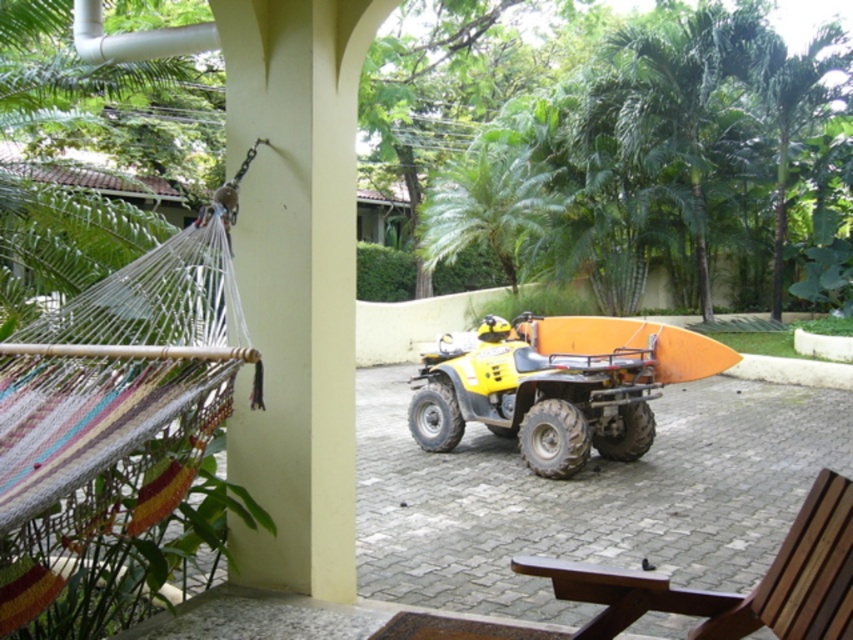
Question: Does brown wooden chair at lower right lie in front of orange matte surfboard at center?

Choices:
 (A) no
 (B) yes

Answer: (B)

Question: Is brown wooden chair at lower right wider than orange matte surfboard at center?

Choices:
 (A) yes
 (B) no

Answer: (B)

Question: Is brown wooden chair at lower right wider than orange matte surfboard at center?

Choices:
 (A) no
 (B) yes

Answer: (A)

Question: Which point appears closest to the camera in this image?

Choices:
 (A) (573, 332)
 (B) (570, 588)

Answer: (B)

Question: Which object is farther from the camera taking this photo?

Choices:
 (A) orange matte surfboard at center
 (B) brown wooden chair at lower right

Answer: (A)